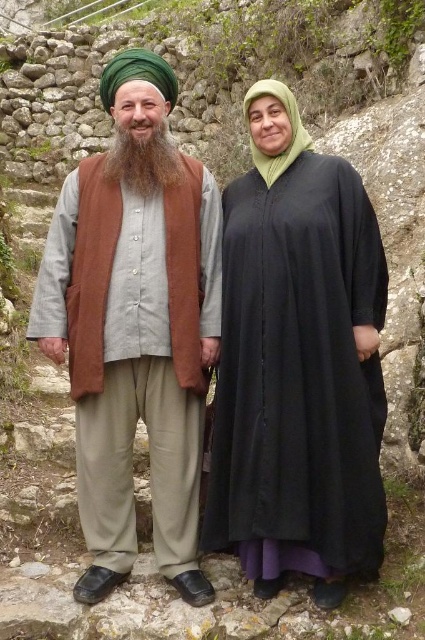
The height and width of the screenshot is (640, 425). Describe the element at coordinates (297, 364) in the screenshot. I see `black matte dress at center` at that location.

Is black matte dress at center smaller than green fabric headscarf at upper right?

Yes.

Is point (255, 419) positioned before point (286, 104)?

That is True.

Where is `black matte dress at center`? black matte dress at center is located at coordinates (297, 364).

Between brown woolen vest at left and brown fuzzy beard at center, which one appears on the left side from the viewer's perspective?

Positioned to the left is brown woolen vest at left.

Which is above, brown woolen vest at left or brown fuzzy beard at center?

Positioned higher is brown fuzzy beard at center.

This screenshot has height=640, width=425. Describe the element at coordinates (141, 401) in the screenshot. I see `brown woolen vest at left` at that location.

This screenshot has width=425, height=640. I want to click on brown woolen vest at left, so click(141, 401).

Can you confirm if black matte dress at center is smaller than brown woolen vest at left?

Correct, black matte dress at center occupies less space than brown woolen vest at left.

The height and width of the screenshot is (640, 425). Find the location of `black matte dress at center`. black matte dress at center is located at coordinates (297, 364).

Is point (323, 401) farther from viewer compared to point (161, 244)?

That is False.

What are the coordinates of `black matte dress at center` in the screenshot? It's located at (297, 364).